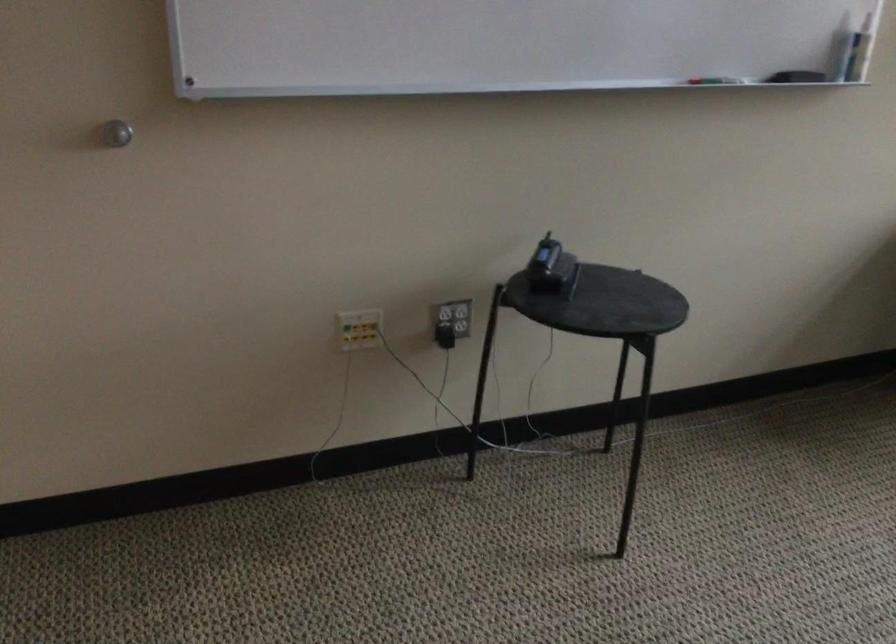
What do you see at coordinates (116, 133) in the screenshot?
I see `a silver thermostat dial` at bounding box center [116, 133].